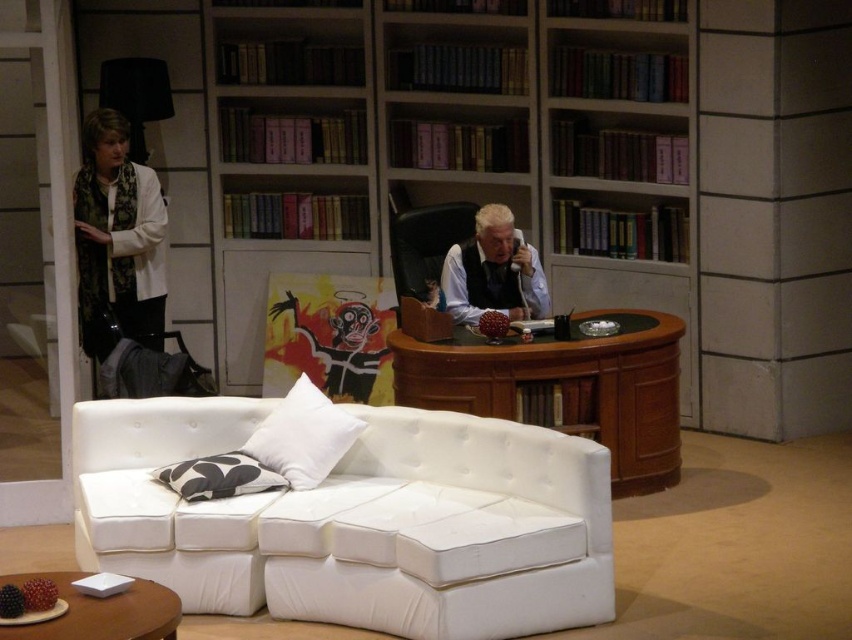
Who is positioned more to the right, wooden desk at center or white leather vest at center?

wooden desk at center

Does wooden desk at center have a greater height compared to white leather vest at center?

Indeed, wooden desk at center has a greater height compared to white leather vest at center.

This screenshot has height=640, width=852. Describe the element at coordinates (557, 384) in the screenshot. I see `wooden desk at center` at that location.

The height and width of the screenshot is (640, 852). Identify the location of wooden desk at center. (557, 384).

Is white textured scarf at left behind gray-patterned fabric pillow at lower center?

Yes.

In order to click on white textured scarf at left in this screenshot , I will do `click(117, 241)`.

The width and height of the screenshot is (852, 640). Identify the location of white textured scarf at left. (117, 241).

Does wooden bookcase at upper center have a greater width compared to white textured scarf at left?

Yes, wooden bookcase at upper center is wider than white textured scarf at left.

Can you confirm if wooden bookcase at upper center is thinner than white textured scarf at left?

Incorrect, wooden bookcase at upper center's width is not less than white textured scarf at left's.

The image size is (852, 640). What are the coordinates of `wooden bookcase at upper center` in the screenshot? It's located at (419, 141).